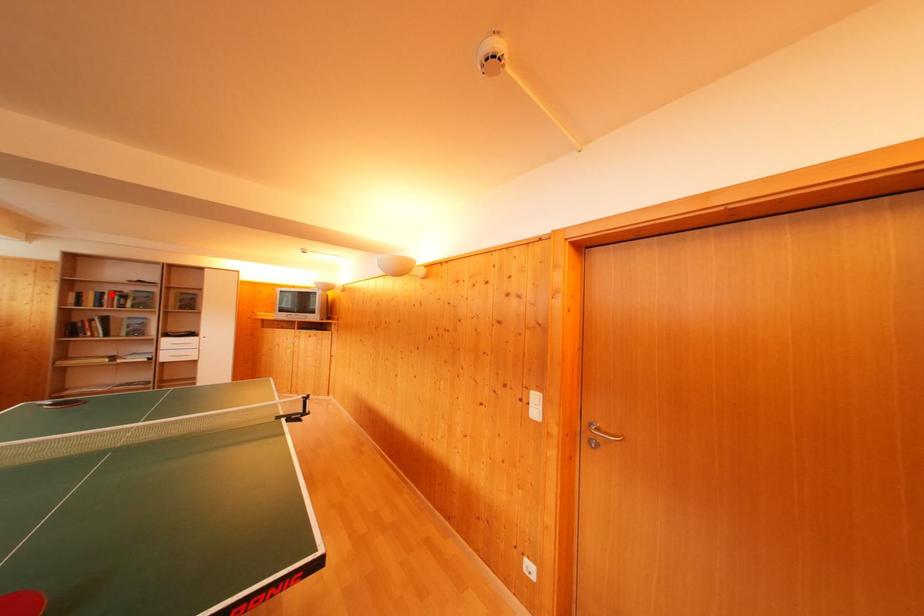
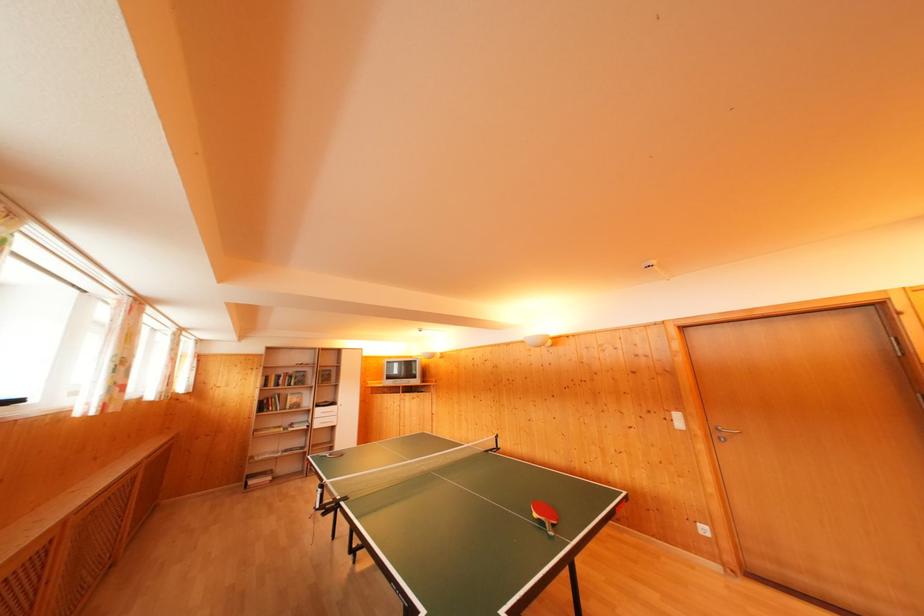
Find the pixel in the second image that matches the highlighted location in the first image.

(286, 377)